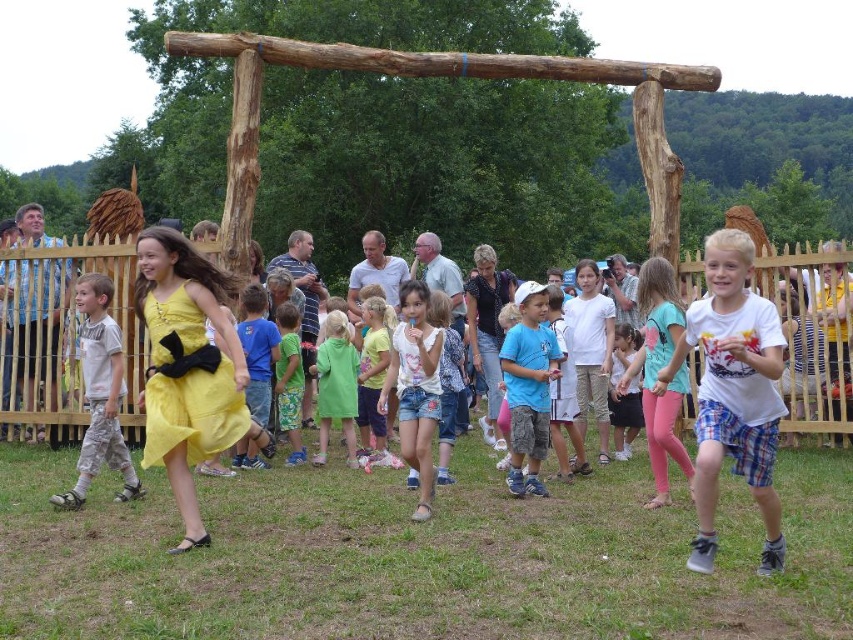
Can you confirm if white cotton t-shirt at center is thinner than camouflage-patterned shorts at left?

In fact, white cotton t-shirt at center might be wider than camouflage-patterned shorts at left.

Does white cotton t-shirt at center lie in front of camouflage-patterned shorts at left?

Yes, it is in front of camouflage-patterned shorts at left.

Image resolution: width=853 pixels, height=640 pixels. Describe the element at coordinates (733, 394) in the screenshot. I see `white cotton t-shirt at center` at that location.

What are the coordinates of `white cotton t-shirt at center` in the screenshot? It's located at pyautogui.click(x=733, y=394).

Who is more forward, (160, 376) or (27, 280)?

Point (160, 376) is in front.

Between yellow chiffon dress at center and blue plaid shirt at left, which one has more height?

Standing taller between the two is blue plaid shirt at left.

This screenshot has width=853, height=640. I want to click on yellow chiffon dress at center, so click(x=187, y=368).

Between yellow chiffon dress at center and green matte dress at center, which one appears on the right side from the viewer's perspective?

From the viewer's perspective, green matte dress at center appears more on the right side.

Can you confirm if yellow chiffon dress at center is smaller than green matte dress at center?

Actually, yellow chiffon dress at center might be larger than green matte dress at center.

The image size is (853, 640). What do you see at coordinates (187, 368) in the screenshot?
I see `yellow chiffon dress at center` at bounding box center [187, 368].

Find the location of a particular element. The width and height of the screenshot is (853, 640). yellow chiffon dress at center is located at coordinates (187, 368).